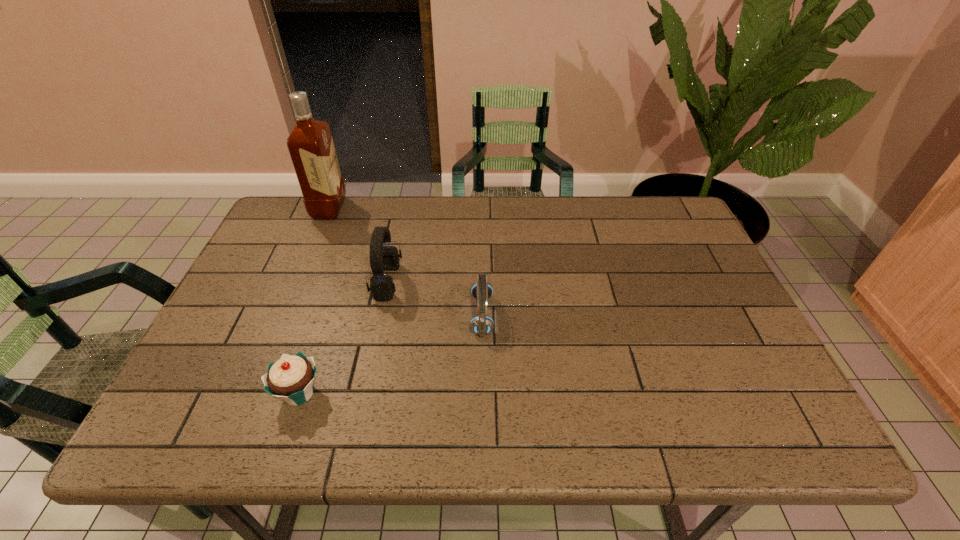
Locate an element on the screen. vacant region between the tallest object and the taller headset is located at coordinates (358, 246).

The height and width of the screenshot is (540, 960). I want to click on vacant area that lies between the second tallest object and the nearest object, so click(344, 338).

Locate an element on the screen. The image size is (960, 540). vacant area that lies between the leftmost object and the left headset is located at coordinates (358, 246).

Point out which object is positioned as the second nearest to the left headset. Please provide its 2D coordinates. Your answer should be formatted as a tuple, i.e. [(x, y)], where the tuple contains the x and y coordinates of a point satisfying the conditions above.

[(291, 378)]

Identify which object is located as the third nearest to the rightmost object. Please provide its 2D coordinates. Your answer should be formatted as a tuple, i.e. [(x, y)], where the tuple contains the x and y coordinates of a point satisfying the conditions above.

[(310, 144)]

The width and height of the screenshot is (960, 540). In order to click on vacant position in the image that satisfies the following two spatial constraints: 1. on the back side of the cupcake; 2. on the front label of the tallest object in this screenshot , I will do `click(361, 209)`.

Where is `vacant area in the image that satisfies the following two spatial constraints: 1. on the front label of the tallest object; 2. on the left side of the nearest object`? The image size is (960, 540). vacant area in the image that satisfies the following two spatial constraints: 1. on the front label of the tallest object; 2. on the left side of the nearest object is located at coordinates (252, 393).